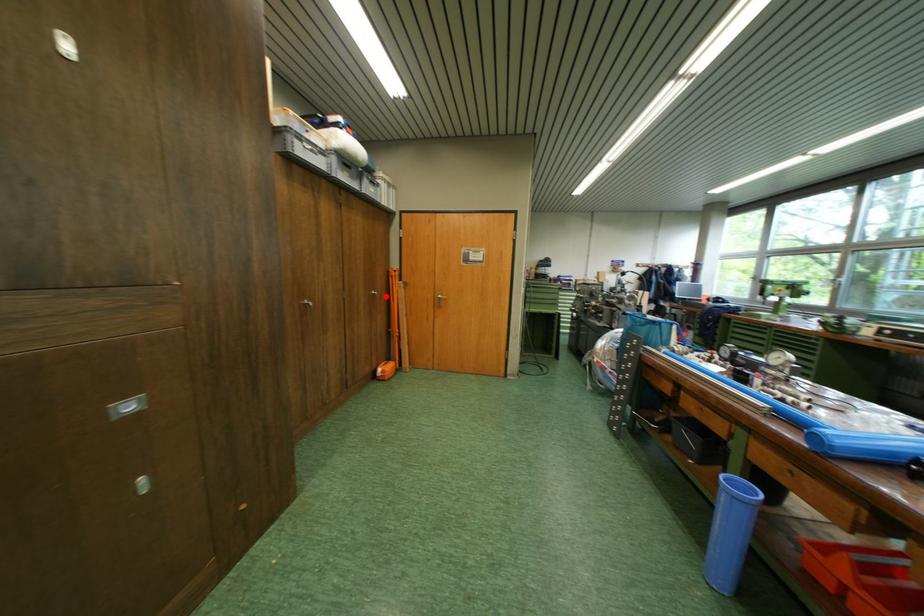
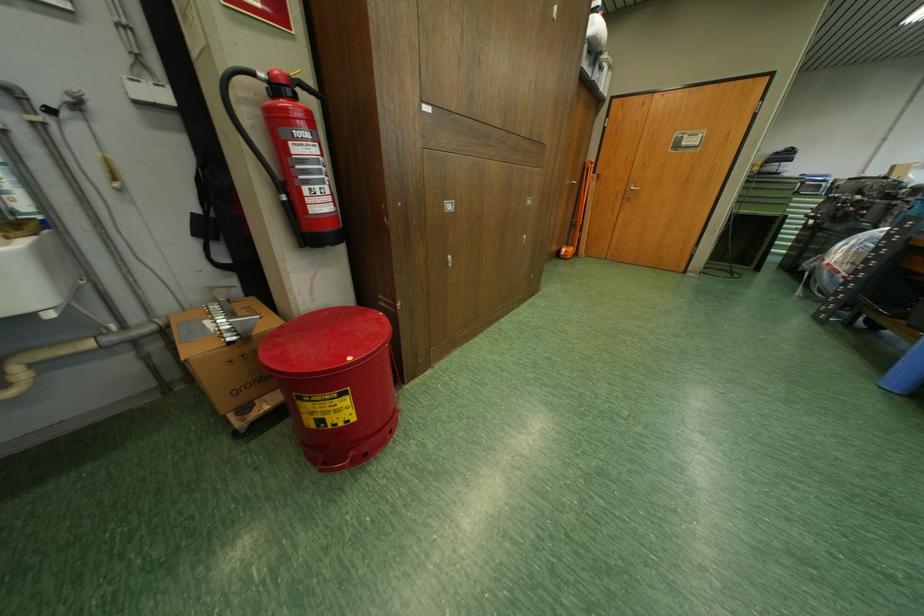
Question: I am providing you with two images of the same scene from different viewpoints. A red point is shown in image1. For the corresponding object point in image2, is it positioned nearer or farther from the camera?

Choices:
 (A) Nearer
 (B) Farther

Answer: (A)